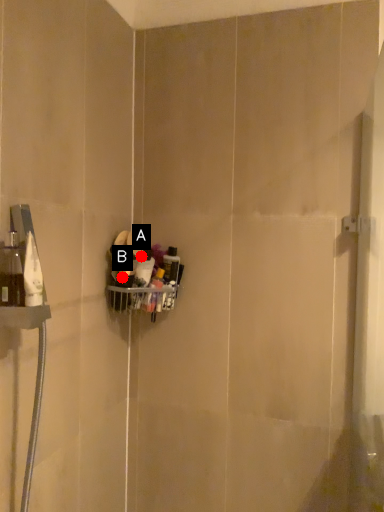
Question: Two points are circled on the image, labeled by A and B beside each circle. Which point is closer to the camera?

Choices:
 (A) A is closer
 (B) B is closer

Answer: (B)